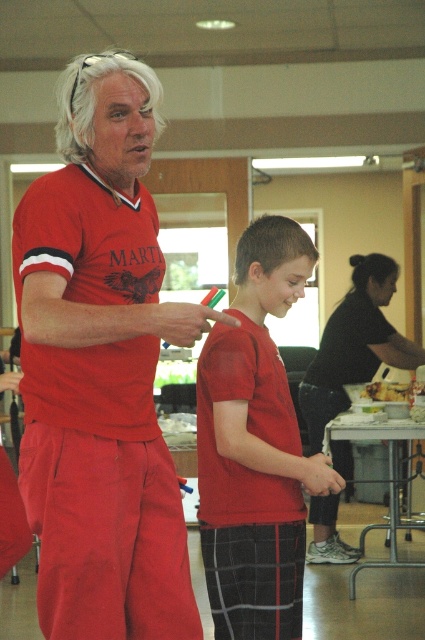
Question: Which point is farther from the camera taking this photo?

Choices:
 (A) (419, 385)
 (B) (221, 371)
 (C) (184, 605)

Answer: (A)

Question: Does matte red shirt at center lie in front of matte red t-shirt at center?

Choices:
 (A) yes
 (B) no

Answer: (A)

Question: Which object is the closest to the smooth white cheese at center?

Choices:
 (A) matte red shirt at center
 (B) matte red t-shirt at center

Answer: (B)

Question: Does matte red shirt at center have a larger size compared to matte red t-shirt at center?

Choices:
 (A) no
 (B) yes

Answer: (B)

Question: Can you confirm if matte red shirt at center is smaller than matte red t-shirt at center?

Choices:
 (A) yes
 (B) no

Answer: (B)

Question: Which object is farther from the camera taking this photo?

Choices:
 (A) smooth white cheese at center
 (B) matte red t-shirt at center

Answer: (A)